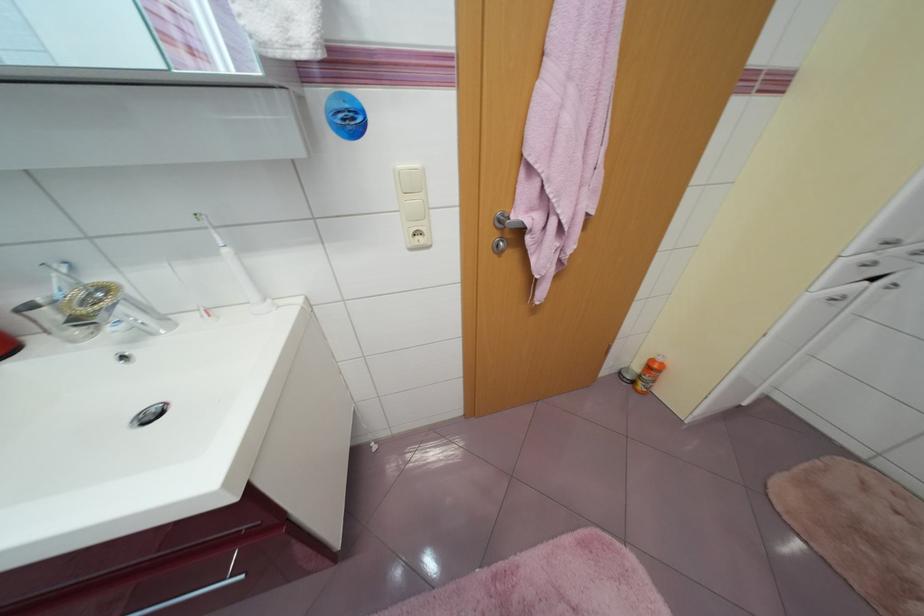
You are a GUI agent. You are given a task and a screenshot of the screen. Output one action in this format:
    pyautogui.click(x=<x>, y=<y>)
    Task: Click on the orange spray bottle
    
    Given the screenshot: What is the action you would take?
    pyautogui.click(x=649, y=374)